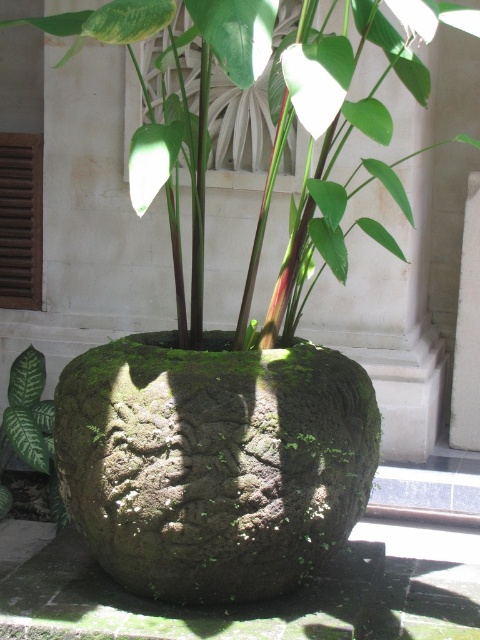
Who is lower down, green mossy stone pot at center or green matte leaf at lower left?

green matte leaf at lower left is below.

Can you confirm if green mossy stone pot at center is positioned above green matte leaf at lower left?

Indeed, green mossy stone pot at center is positioned over green matte leaf at lower left.

Find the location of a particular element. This screenshot has height=640, width=480. green mossy stone pot at center is located at coordinates (175, 104).

Identify the location of green mossy stone pot at center. The image size is (480, 640). (175, 104).